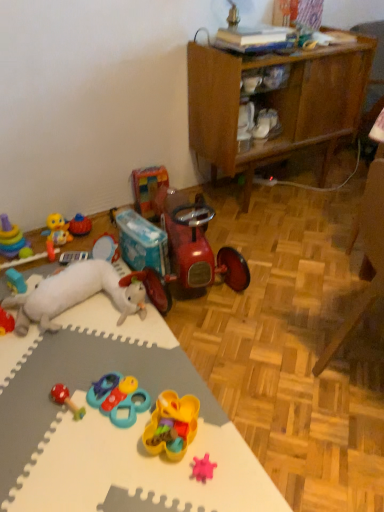
Locate an element on the screen. This screenshot has width=384, height=512. vacant area situated below rubberized plastic toy at left, which ranks as the second toy in left-to-right order (from a real-world perspective) is located at coordinates (37, 263).